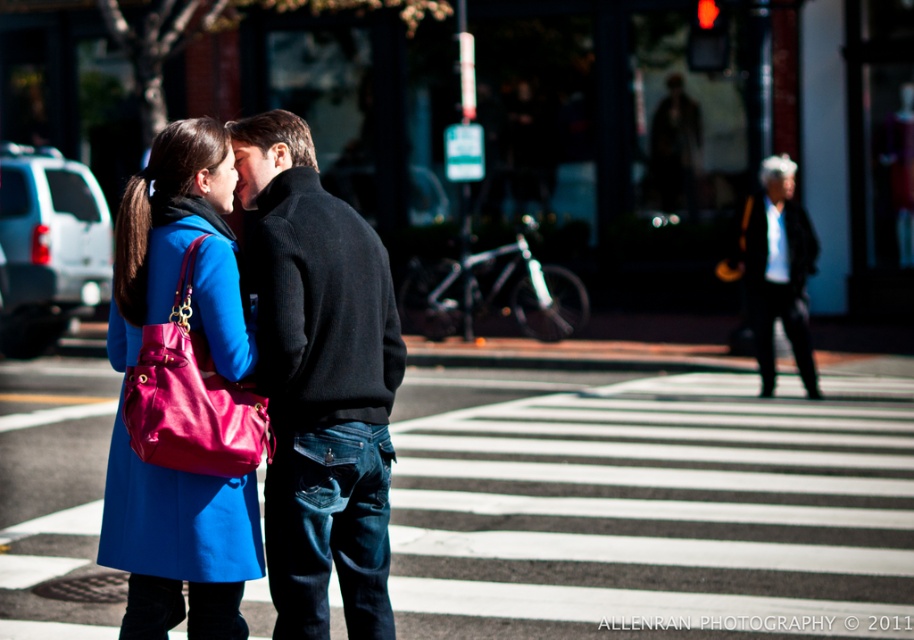
You are a photographer who wants to capture a photo of the black wool sweater at center and the black wool coat at upper right. Based on their positions, which object is closer to the left side of the frame?

The black wool sweater at center is to the left of the black wool coat at upper right, so the sweater is closer to the left side of the frame.

Looking at this image, you are a photographer who wants to ensure both the black wool sweater at center and the matte blue coat at center are clearly visible in your portrait. Based on their sizes, which one might require more careful framing to avoid being overshadowed?

The matte blue coat at center is shorter than the black wool sweater at center, so it might need more attention in framing to ensure it isn not overshadowed by the taller sweater.